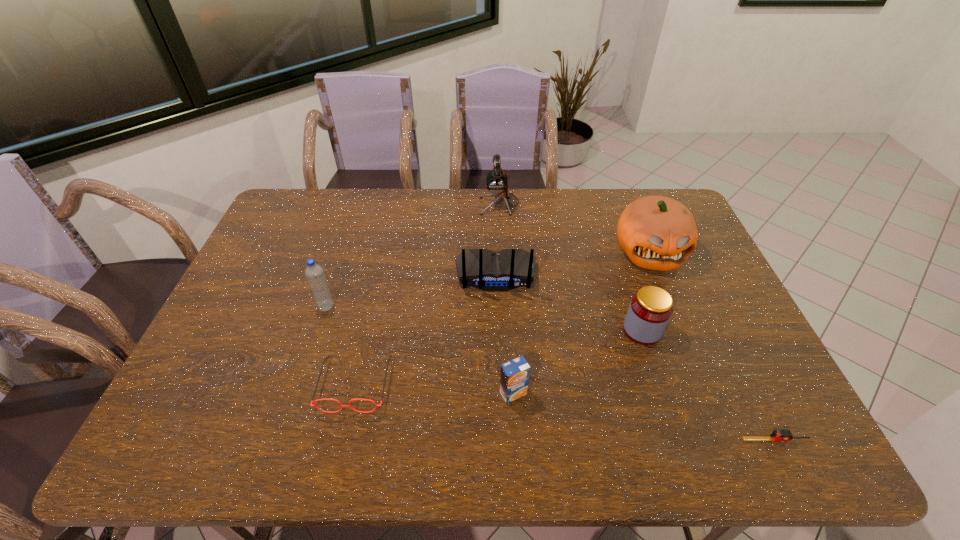
Identify the location of tape measure. (779, 435).

Find the location of `free space located 0.150m on the right of the earphone`. free space located 0.150m on the right of the earphone is located at coordinates (560, 204).

Where is `free space located 0.230m on the face of the pumpkin`? free space located 0.230m on the face of the pumpkin is located at coordinates (684, 336).

Find the location of a particular element. The image size is (960, 540). vacant space located 0.080m on the back of the fourth farthest object is located at coordinates (335, 281).

Image resolution: width=960 pixels, height=540 pixels. Find the location of `vacant space located 0.260m on the back of the router`. vacant space located 0.260m on the back of the router is located at coordinates (499, 370).

Where is `blank area located 0.240m on the left of the jar`? Image resolution: width=960 pixels, height=540 pixels. blank area located 0.240m on the left of the jar is located at coordinates tap(536, 330).

Where is `free space located 0.380m on the back of the sixth tallest object`? free space located 0.380m on the back of the sixth tallest object is located at coordinates (506, 275).

Locate an element on the screen. The image size is (960, 540). vacant area situated 0.370m on the back of the shortest object is located at coordinates (712, 312).

Locate an element on the screen. earphone at the far edge is located at coordinates (497, 183).

This screenshot has height=540, width=960. I want to click on pumpkin located in the far edge section of the desktop, so click(x=657, y=233).